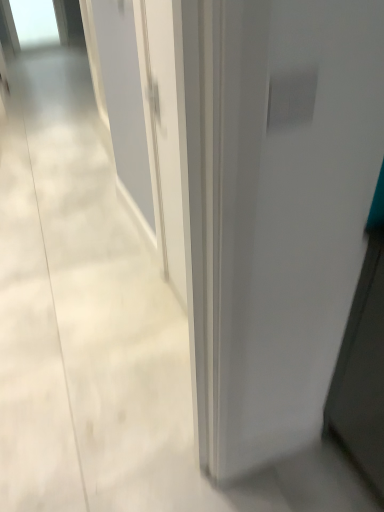
The image size is (384, 512). I want to click on white glossy door at center, so click(162, 133).

What is the approximate width of white glossy door at center?

white glossy door at center is 3.22 inches wide.

Describe the element at coordinates (162, 133) in the screenshot. I see `white glossy door at center` at that location.

Locate an element on the screen. white glossy door at center is located at coordinates [162, 133].